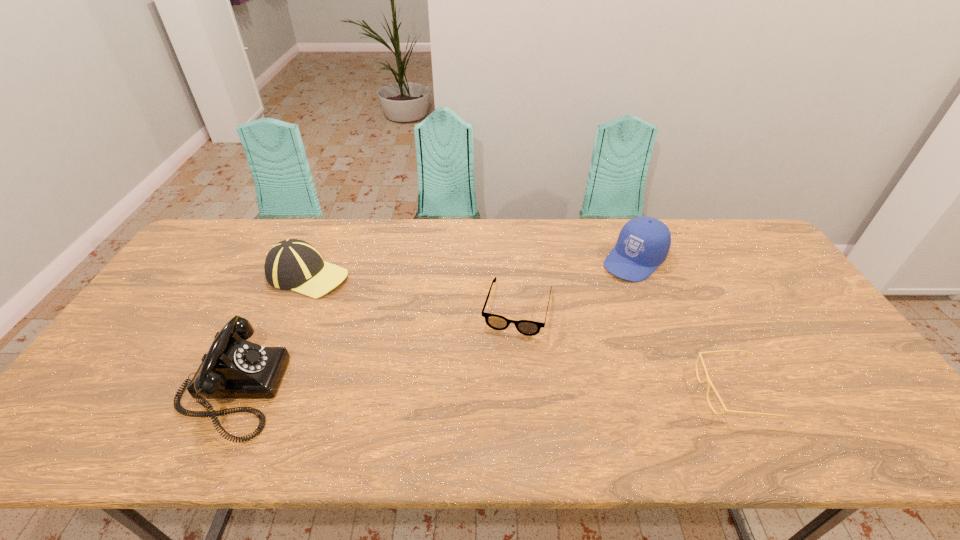
At what (x,y) coordinates should I click in order to perform the action: click on free space located 0.130m on the front-facing side of the cap. Please return your answer as a coordinate pair (x, y). The height and width of the screenshot is (540, 960). Looking at the image, I should click on (594, 298).

At what (x,y) coordinates should I click in order to perform the action: click on vacant area located on the front-facing side of the cap. Please return your answer as a coordinate pair (x, y). The width and height of the screenshot is (960, 540). Looking at the image, I should click on (594, 298).

You are a GUI agent. You are given a task and a screenshot of the screen. Output one action in this format:
    pyautogui.click(x=<x>, y=<y>)
    Task: Click on the free spot located on the front-facing side of the cap
    The width and height of the screenshot is (960, 540).
    Given the screenshot: What is the action you would take?
    pyautogui.click(x=588, y=303)

Locate an element on the screen. vacant region located with the brim of the third tallest object facing forward is located at coordinates (403, 332).

Locate an element on the screen. blank space located with the brim of the third tallest object facing forward is located at coordinates [366, 308].

The width and height of the screenshot is (960, 540). Identify the location of vacant space located 0.180m with the brim of the third tallest object facing forward. (377, 315).

At what (x,y) coordinates should I click in order to perform the action: click on free region located on the arms of the third object from left to right. Please return your answer as a coordinate pair (x, y). The image size is (960, 540). Looking at the image, I should click on (501, 377).

Where is `vacant position located on the arms of the third object from left to right`? This screenshot has width=960, height=540. vacant position located on the arms of the third object from left to right is located at coordinates (492, 408).

I want to click on vacant position located on the arms of the third object from left to right, so click(x=506, y=358).

The height and width of the screenshot is (540, 960). Identify the location of cap present at the far edge. (643, 243).